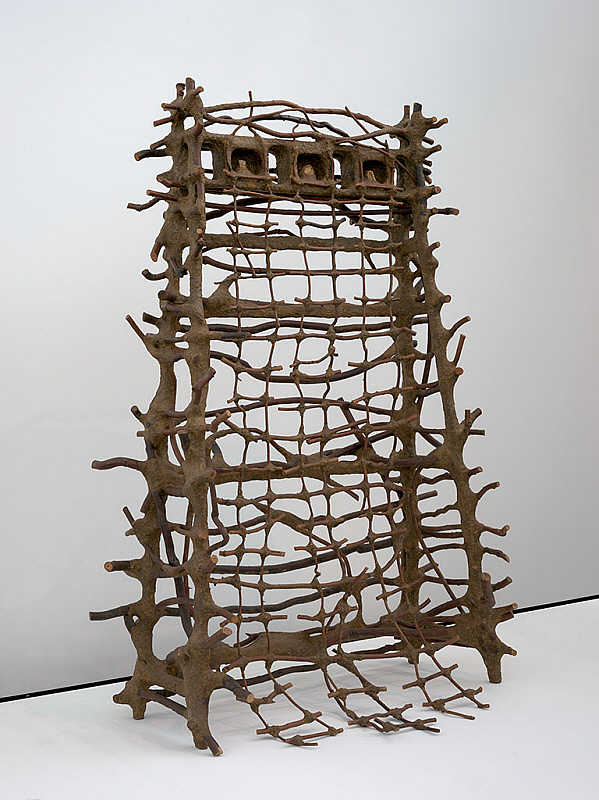
This screenshot has width=599, height=800. I want to click on black grout, so click(x=72, y=690).